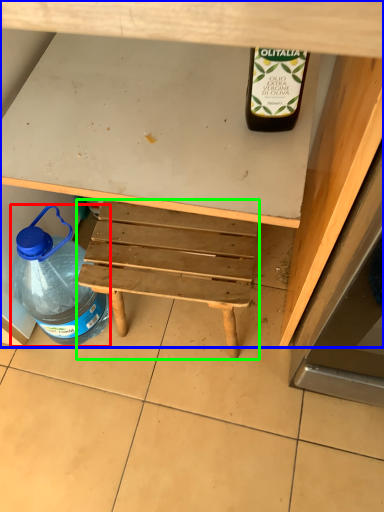
Question: Which object is the closest to the bottle (highlighted by a red box)? Choose among these: desk (highlighted by a blue box) or stool (highlighted by a green box).

Choices:
 (A) desk
 (B) stool

Answer: (B)